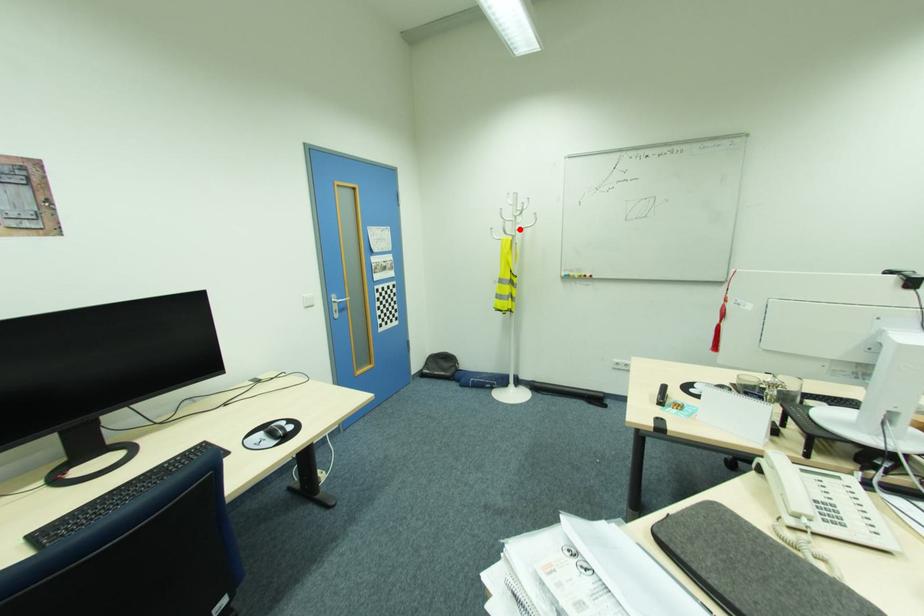
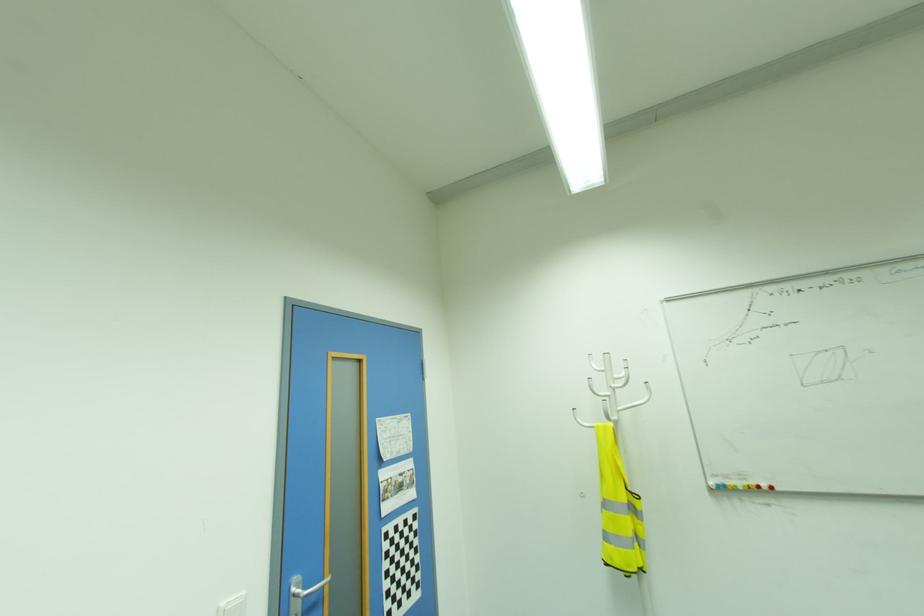
Question: I am providing you with two images of the same scene from different viewpoints. Given a red point in image1, look at the same physical point in image2. Is it:

Choices:
 (A) Closer to the viewpoint
 (B) Farther from the viewpoint

Answer: (B)